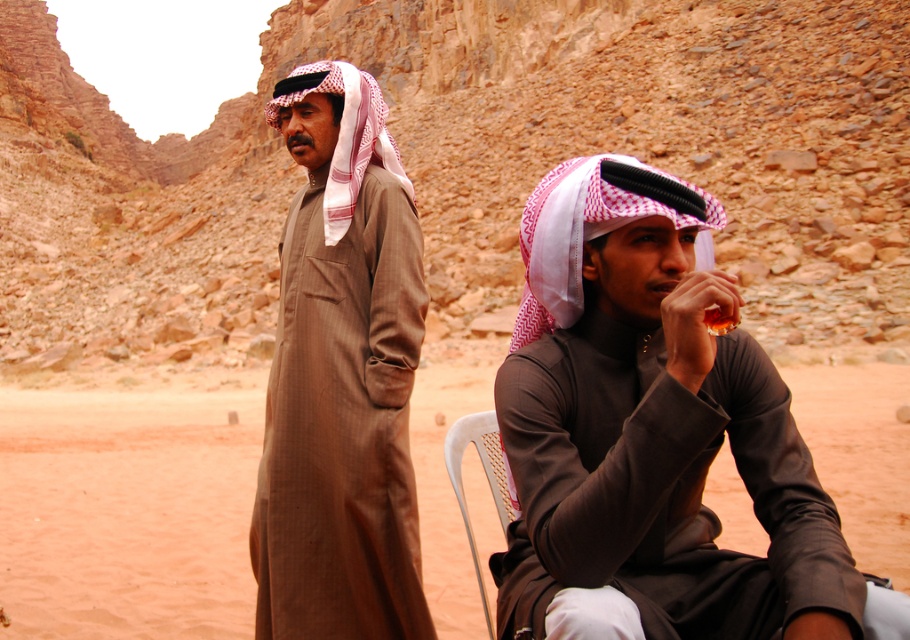
You are a photographer setting up a shoot in the desert scene. You need to position a tripod between the matte brown robe at center and the white plastic chair at center so that it doesn not block either object. Given the height difference between them, where should you place the tripod to ensure it stays below both objects?

The matte brown robe at center is taller than the white plastic chair at center. To ensure the tripod stays below both, position it closer to the white plastic chair at center since it is the shorter object, allowing the tripod height to remain under both.

Based on the scene description, where exactly is the brown matte kandura at center located in the image?

The brown matte kandura at center is located at point 0.589 on the x axis and 0.376 on the y axis.

You are standing in the desert scene and want to place a small flag at one of the two points marked as point (724, 305) and point (391, 305). Which point is closer to you so that the flag will be more visible from where you are standing?

Point (724, 305) is closer to the viewer than point (391, 305), so placing the flag there will make it more visible from your current position.